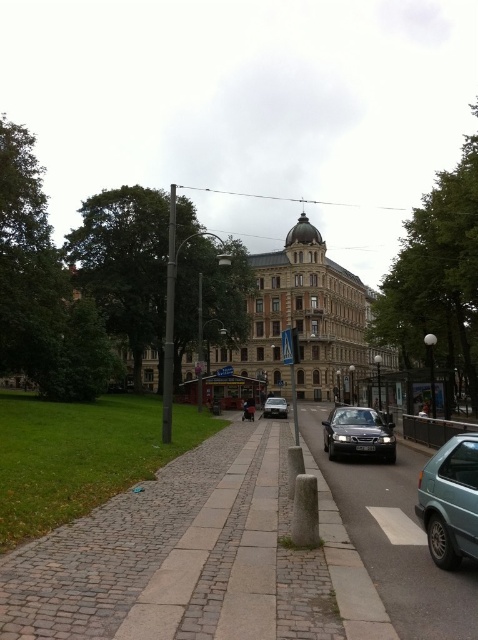
You are a delivery person standing on the gray concrete pavement at center and need to load a package onto the shiny black car at center. Which object is lower in height, allowing you to easily access the car?

The gray concrete pavement at center has a lesser height compared to the shiny black car at center, so you can easily access the car from the pavement since it is higher.

You are standing on the pathway in the urban street scene. You see two points marked on the image. One is at coordinates point (413, 452) and the other is at point (262, 408). Which point is closer to you?

Point (413, 452) is closer to the viewer than point (262, 408).

You are a delivery person trying to park your silver metallic van at center in a parking spot that can only accommodate vehicles up to the size of the shiny black car at center. Can your van fit in the parking spot?

The shiny black car at center is larger in size than the silver metallic van at center, so the silver metallic van at center will fit in the parking spot designed for the size of the shiny black car at center.